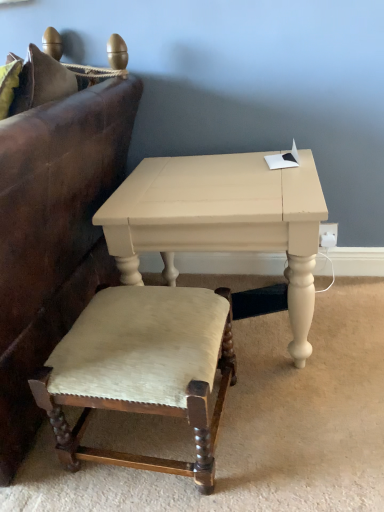
Identify the location of free space between velvet upholstered stool at lower left and matte white table at center. The image size is (384, 512). (260, 414).